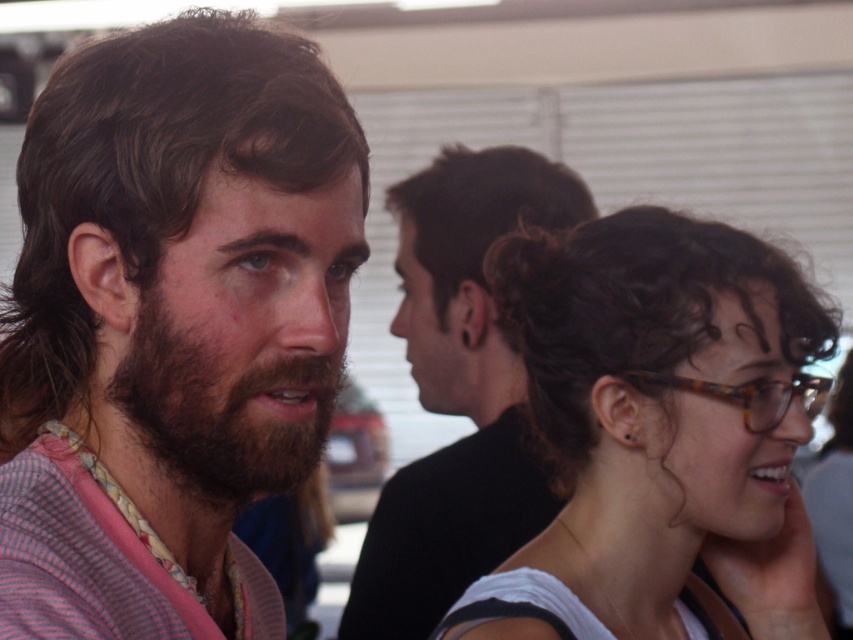
Is brownwoollybeard at left above dark brown curly hair at center?

Actually, brownwoollybeard at left is below dark brown curly hair at center.

Who is shorter, brownwoollybeard at left or dark brown curly hair at center?

Standing shorter between the two is brownwoollybeard at left.

Which is behind, point (157, 332) or point (473, 198)?

The point (473, 198) is behind.

Identify the location of brownwoollybeard at left. (219, 412).

Can you confirm if striped fabric shirt at left is smaller than dark brown curly hair at center?

Indeed, striped fabric shirt at left has a smaller size compared to dark brown curly hair at center.

Is the position of striped fabric shirt at left more distant than that of dark brown curly hair at center?

No, striped fabric shirt at left is in front of dark brown curly hair at center.

Measure the distance between striped fabric shirt at left and camera.

striped fabric shirt at left and camera are 30.87 inches apart.

The width and height of the screenshot is (853, 640). Find the location of `striped fabric shirt at left`. striped fabric shirt at left is located at coordinates (186, 268).

Between point (793, 624) and point (428, 200), which one is positioned in front?

Point (793, 624)

Can you confirm if brown hair at center is positioned below dark brown curly hair at center?

Yes, brown hair at center is below dark brown curly hair at center.

What do you see at coordinates (659, 433) in the screenshot? The width and height of the screenshot is (853, 640). I see `brown hair at center` at bounding box center [659, 433].

Where is `brown hair at center`? This screenshot has width=853, height=640. brown hair at center is located at coordinates [659, 433].